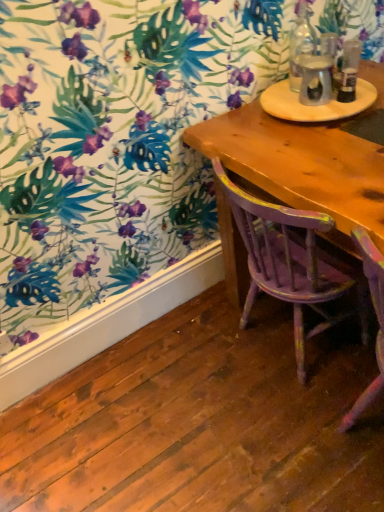
Identify the location of vacant space situated above distressed purple wood chair at center (from a real-world perspective). The image size is (384, 512). (304, 160).